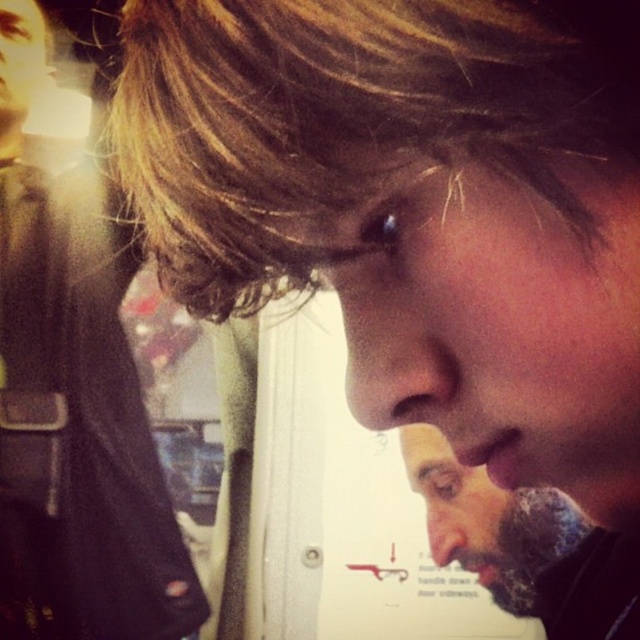
Does blondehair at upper center have a greater width compared to matte black jacket at left?

No, blondehair at upper center is not wider than matte black jacket at left.

Does blondehair at upper center come in front of matte black jacket at left?

Yes, it is in front of matte black jacket at left.

I want to click on blondehair at upper center, so click(349, 120).

The image size is (640, 640). I want to click on blondehair at upper center, so click(x=349, y=120).

Which is behind, point (500, 531) or point (397, 342)?

The point (500, 531) is behind.

Identify the location of gray textured beard at lower right. This screenshot has width=640, height=640. (490, 522).

Between blondehair at upper center and gray textured beard at lower right, which one is positioned lower?

gray textured beard at lower right

Is blondehair at upper center further to camera compared to gray textured beard at lower right?

No, blondehair at upper center is closer to the viewer.

Describe the element at coordinates (349, 120) in the screenshot. I see `blondehair at upper center` at that location.

Locate an element on the screen. This screenshot has height=640, width=640. blondehair at upper center is located at coordinates (349, 120).